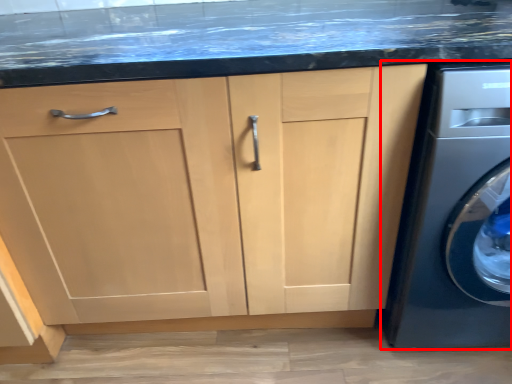
Question: From the image's perspective, where is washing machine (annotated by the red box) located in relation to cabinetry in the image?

Choices:
 (A) above
 (B) below

Answer: (A)